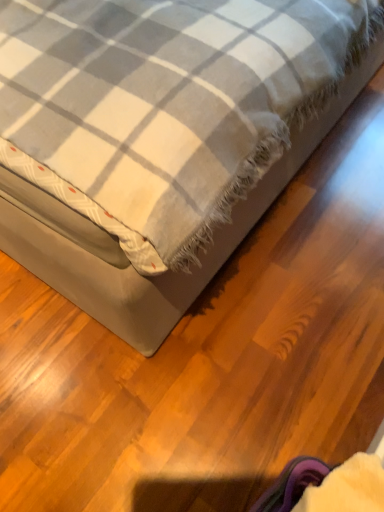
Locate an element on the screen. gray cotton bed at center is located at coordinates (161, 137).

What is the approximate width of gray cotton bed at center?

gray cotton bed at center is 5.54 feet in width.

The height and width of the screenshot is (512, 384). What do you see at coordinates (161, 137) in the screenshot?
I see `gray cotton bed at center` at bounding box center [161, 137].

At what (x,y) coordinates should I click in order to perform the action: click on gray cotton bed at center. Please return your answer as a coordinate pair (x, y). Looking at the image, I should click on tap(161, 137).